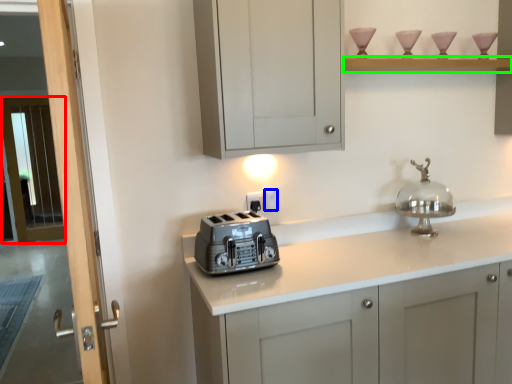
Question: Based on their relative distances, which object is nearer to screen door (highlighted by a red box)? Choose from electric outlet (highlighted by a blue box) and shelf (highlighted by a green box).

Choices:
 (A) electric outlet
 (B) shelf

Answer: (A)